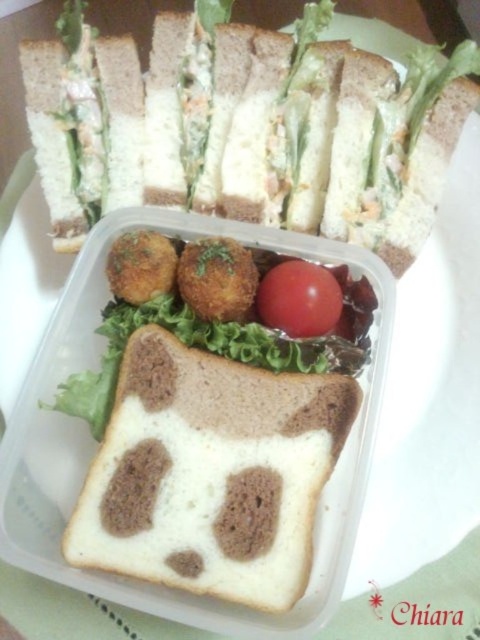
Is white bread with brown filling at center shorter than red smooth tomato at center?

No.

Can you confirm if white bread with brown filling at center is smaller than red smooth tomato at center?

Actually, white bread with brown filling at center might be larger than red smooth tomato at center.

Who is more distant from viewer, (350, 65) or (310, 324)?

The point (350, 65) is behind.

This screenshot has height=640, width=480. In order to click on white bread with brown filling at center in this screenshot , I will do `click(247, 132)`.

Between white bread with brown filling at center and white soft bread at center, which one has less height?

With less height is white soft bread at center.

Who is more forward, (365, 163) or (204, 476)?

Point (204, 476) is in front.

Describe the element at coordinates (247, 132) in the screenshot. The width and height of the screenshot is (480, 640). I see `white bread with brown filling at center` at that location.

I want to click on white bread with brown filling at center, so click(x=247, y=132).

Does white soft bread at center have a greater height compared to red smooth tomato at center?

Correct, white soft bread at center is much taller as red smooth tomato at center.

Between white soft bread at center and red smooth tomato at center, which one has less height?

red smooth tomato at center

Is point (201, 540) in front of point (285, 332)?

Yes, it is in front of point (285, 332).

Identify the location of white soft bread at center. (211, 474).